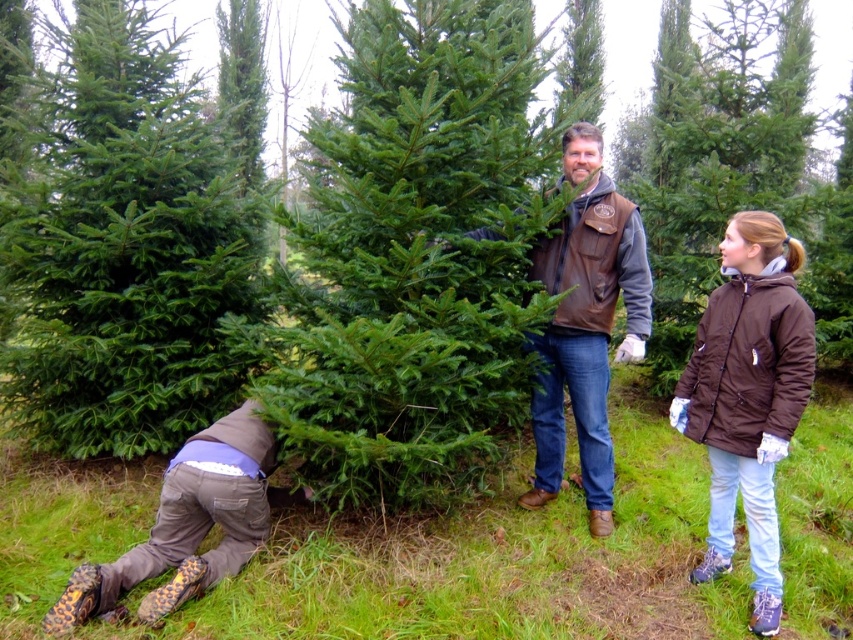
Does green matte tree at center appear over brown/canvas pants at lower left?

Indeed, green matte tree at center is positioned over brown/canvas pants at lower left.

Is green matte tree at center shorter than brown/canvas pants at lower left?

Correct, green matte tree at center is not as tall as brown/canvas pants at lower left.

Find the location of a particular element. The image size is (853, 640). green matte tree at center is located at coordinates (728, 164).

The image size is (853, 640). I want to click on green matte tree at center, so click(728, 164).

Is point (395, 365) positioned after point (173, 547)?

No, (395, 365) is closer to viewer.

Which is more to the right, green matte christmas tree at center or brown/canvas pants at lower left?

green matte christmas tree at center

At what (x,y) coordinates should I click in order to perform the action: click on green matte christmas tree at center. Please return your answer as a coordinate pair (x, y). The image size is (853, 640). Looking at the image, I should click on (415, 256).

Does green matte fir tree at lower left appear under green matte tree at center?

Incorrect, green matte fir tree at lower left is not positioned below green matte tree at center.

Is green matte fir tree at lower left wider than green matte tree at center?

Correct, the width of green matte fir tree at lower left exceeds that of green matte tree at center.

This screenshot has width=853, height=640. Describe the element at coordinates (128, 252) in the screenshot. I see `green matte fir tree at lower left` at that location.

Image resolution: width=853 pixels, height=640 pixels. What are the coordinates of `green matte fir tree at lower left` in the screenshot? It's located at (128, 252).